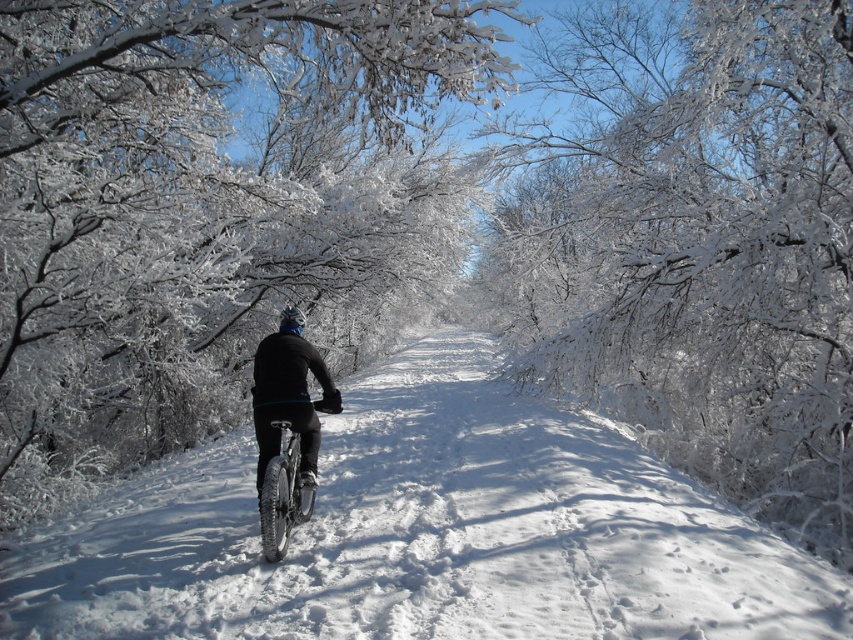
Question: Can you confirm if black matte bicycle at center is smaller than silver metallic bicycle at center?

Choices:
 (A) yes
 (B) no

Answer: (B)

Question: Which point is closer to the camera taking this photo?

Choices:
 (A) (303, 320)
 (B) (79, 545)

Answer: (B)

Question: Estimate the real-world distances between objects in this image. Which object is closer to the black matte bicycle at center?

Choices:
 (A) silver metallic bicycle at center
 (B) white frosty branches at center
 (C) white fluffy snow at center

Answer: (A)

Question: Based on their relative distances, which object is farther from the white frosty branches at center?

Choices:
 (A) black matte bicycle at center
 (B) snow-covered branches at center

Answer: (A)

Question: Is black matte bicycle at center thinner than silver metallic bicycle at center?

Choices:
 (A) no
 (B) yes

Answer: (A)

Question: Can you confirm if white frosty branches at center is bigger than silver metallic bicycle at center?

Choices:
 (A) yes
 (B) no

Answer: (A)